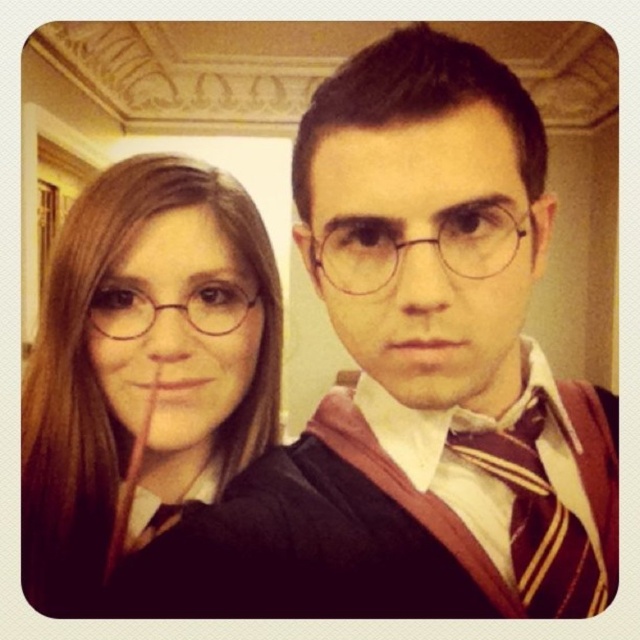
Question: Which point appears closest to the camera in this image?

Choices:
 (A) (346, 224)
 (B) (97, 362)

Answer: (A)

Question: Considering the real-world distances, which object is closest to the clear plastic glasses at center?

Choices:
 (A) matte plastic glasses at center
 (B) matte black robe at left

Answer: (A)

Question: Which of these objects is positioned closest to the striped wool tie at center?

Choices:
 (A) matte plastic glasses at center
 (B) clear plastic glasses at center
 (C) matte black robe at left

Answer: (B)

Question: Is the position of clear plastic glasses at center more distant than that of matte plastic glasses at center?

Choices:
 (A) yes
 (B) no

Answer: (B)

Question: Is clear plastic glasses at center closer to the viewer compared to matte plastic glasses at center?

Choices:
 (A) yes
 (B) no

Answer: (A)

Question: Is striped wool tie at center above matte plastic glasses at center?

Choices:
 (A) no
 (B) yes

Answer: (A)